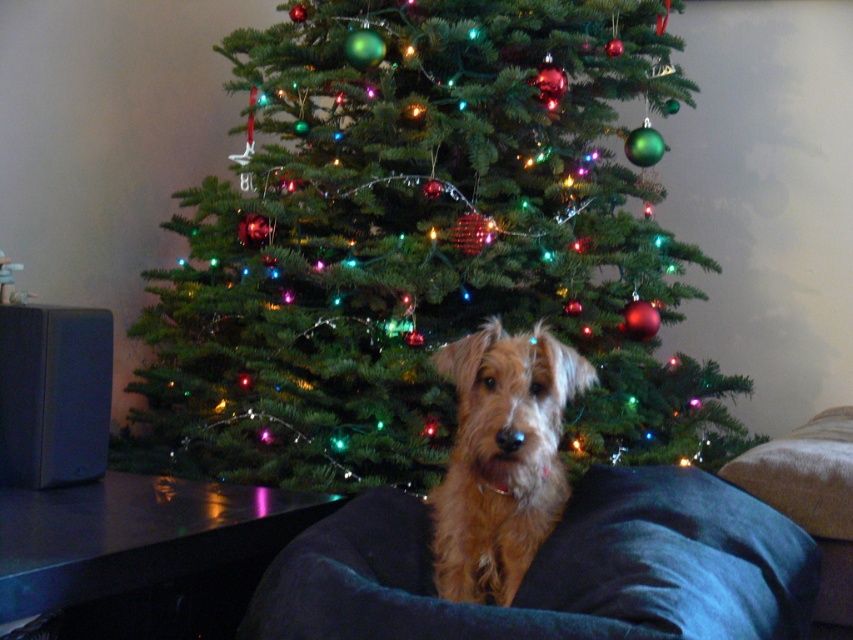
You are standing 3 feet away from the green matte christmas tree at center. If you walk straight towards it, how many more feet do you need to walk to reach it?

You are currently 3 feet away from the green matte christmas tree at center, and the total distance between you and the tree is 6.13 feet. Therefore, you need to walk an additional 3.13 feet to reach it.

You are standing in the room and want to place a new decoration exactly at the center of the room. The green matte christmas tree at center is currently at point 0.384, 0.498. Is the tree already at the center of the room?

The green matte christmas tree at center is located at point (x=424, y=244), which indicates it is positioned at the center of the room.

You are planning to place a new small decorative item on the green matte christmas tree at center. However, you want to ensure there is enough space between the tree and the brown furry dog at center to avoid any accidental knocks. Given that the dog is sitting on a chair, can you determine if the tree is large enough to accommodate the decoration without being too close to the dog?

The green matte christmas tree at center is bigger than the brown furry dog at center, so there should be sufficient space between them to place the decoration safely without risking it being knocked over by the dog.